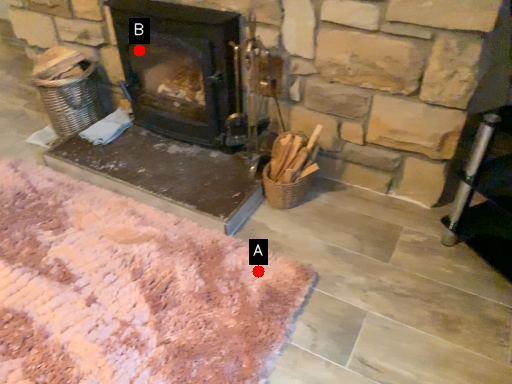
Question: Two points are circled on the image, labeled by A and B beside each circle. Which point is farther from the camera taking this photo?

Choices:
 (A) A is further
 (B) B is further

Answer: (B)